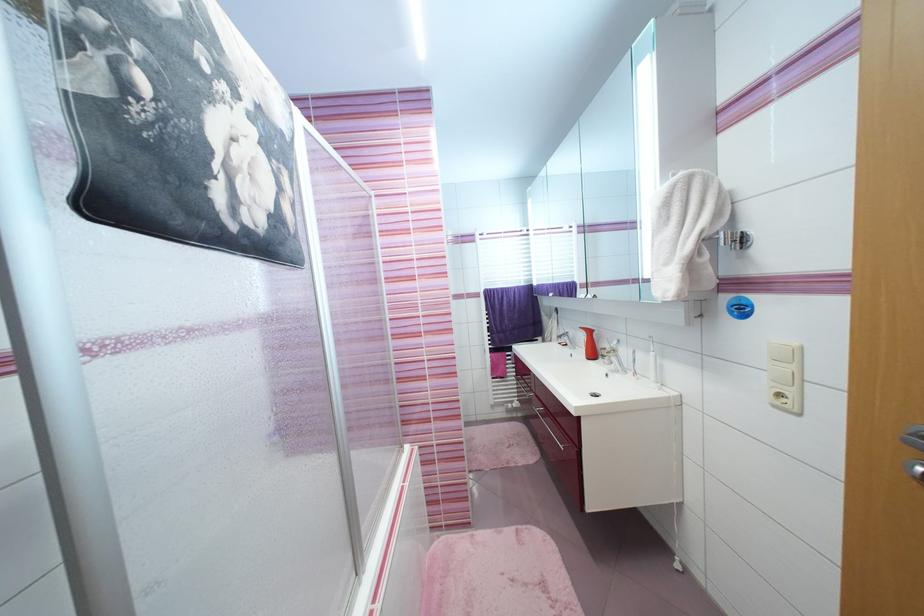
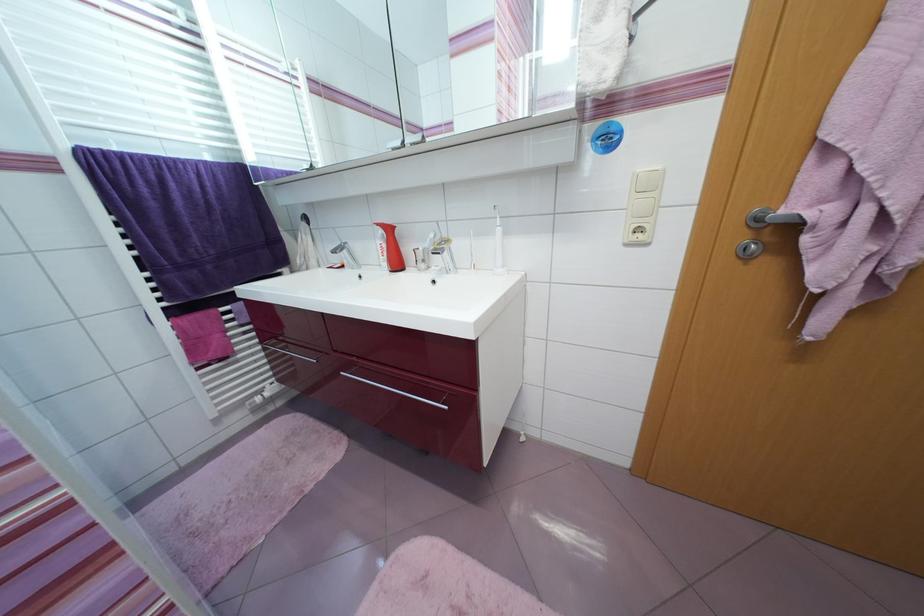
Find the pixel in the second image that matches point (565, 338) in the first image.

(338, 254)